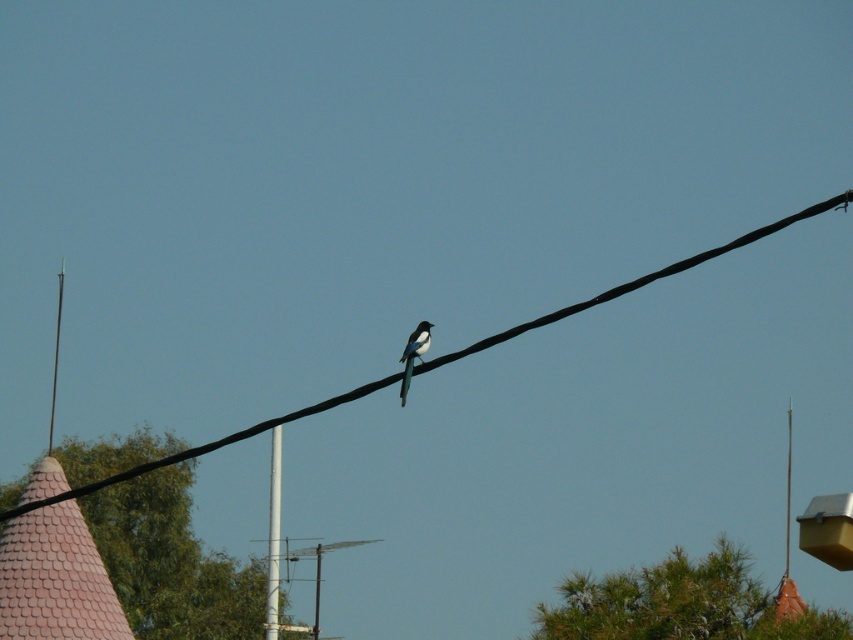
Question: Estimate the real-world distances between objects in this image. Which object is farther from the smooth white pole at left?

Choices:
 (A) white glossy bird at center
 (B) white plastic telegraph pole at center
 (C) black wire at center

Answer: (A)

Question: Estimate the real-world distances between objects in this image. Which object is farther from the white glossy bird at center?

Choices:
 (A) smooth white pole at left
 (B) white plastic telegraph pole at center
 (C) black wire at center

Answer: (A)

Question: Does black wire at center appear over smooth white pole at left?

Choices:
 (A) no
 (B) yes

Answer: (B)

Question: Which point appears closest to the camera in this image?

Choices:
 (A) (408, 348)
 (B) (274, 477)
 (C) (49, 435)

Answer: (A)

Question: Can you confirm if white plastic telegraph pole at center is positioned below smooth white pole at left?

Choices:
 (A) yes
 (B) no

Answer: (A)

Question: Where is white plastic telegraph pole at center located in relation to white glossy bird at center in the image?

Choices:
 (A) above
 (B) below

Answer: (B)